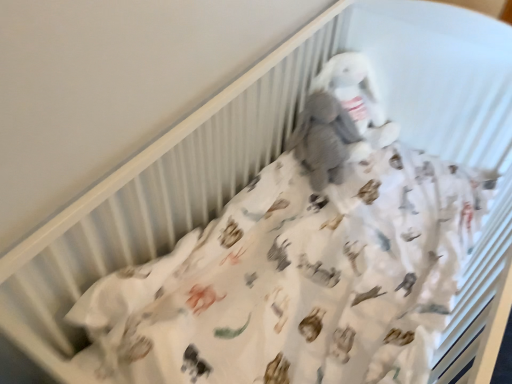
Question: Considering the positions of white plush toy at center and gray plush toy at upper center in the image, is white plush toy at center taller or shorter than gray plush toy at upper center?

Choices:
 (A) tall
 (B) short

Answer: (B)

Question: Is white plush toy at center bigger or smaller than gray plush toy at upper center?

Choices:
 (A) small
 (B) big

Answer: (B)

Question: Is white plush toy at center to the left or to the right of gray plush toy at upper center in the image?

Choices:
 (A) left
 (B) right

Answer: (A)

Question: Visually, is gray plush toy at upper center positioned to the left or to the right of white plush toy at center?

Choices:
 (A) left
 (B) right

Answer: (B)

Question: Is gray plush toy at upper center spatially inside white plush toy at center, or outside of it?

Choices:
 (A) inside
 (B) outside

Answer: (A)

Question: Considering the positions of gray plush toy at upper center and white plush toy at center in the image, is gray plush toy at upper center bigger or smaller than white plush toy at center?

Choices:
 (A) big
 (B) small

Answer: (B)

Question: Looking at their shapes, would you say gray plush toy at upper center is wider or thinner than white plush toy at center?

Choices:
 (A) wide
 (B) thin

Answer: (A)